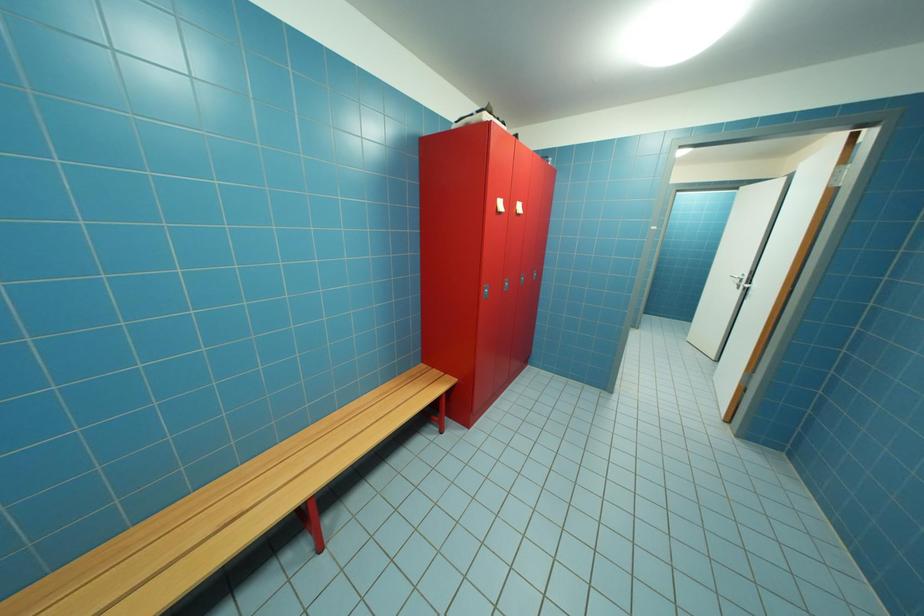
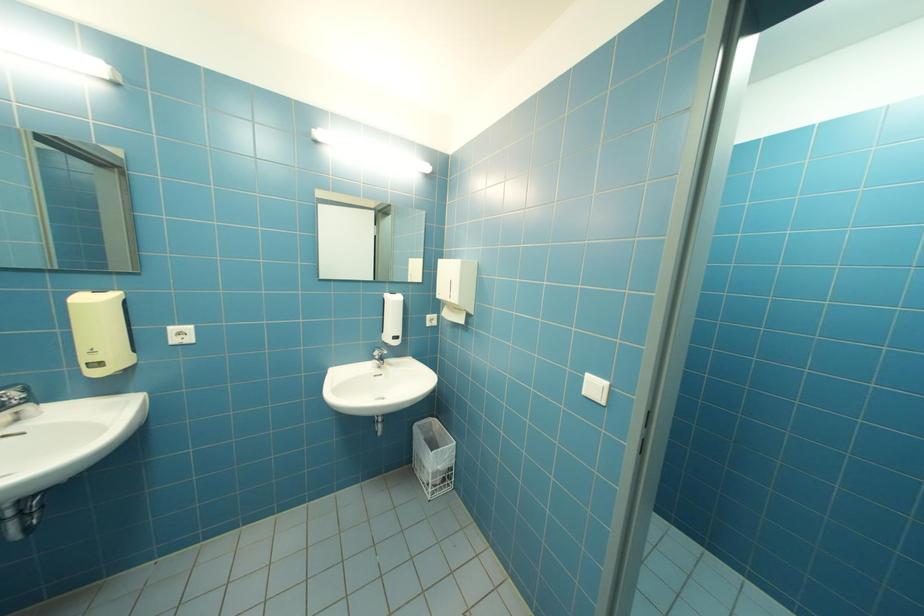
Which direction would the cameraman need to move to produce the second image?

The cameraman walked toward right, forward.